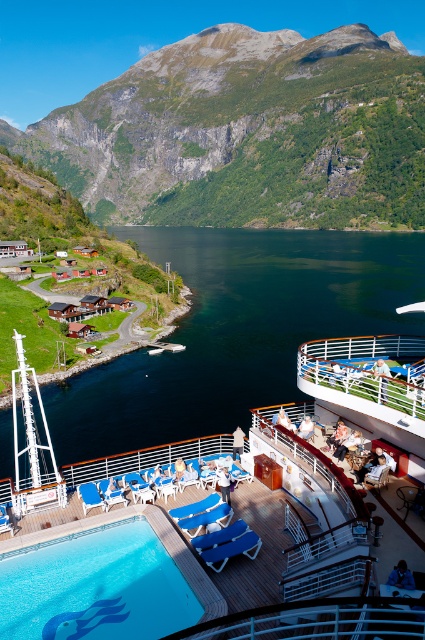
Question: Can you confirm if dark blue water at center is smaller than blue glossy pool at lower left?

Choices:
 (A) no
 (B) yes

Answer: (A)

Question: Estimate the real-world distances between objects in this image. Which object is closer to the green textured mountain at upper left?

Choices:
 (A) dark blue water at center
 (B) blue glossy pool at lower left

Answer: (A)

Question: Among these points, which one is nearest to the camera?

Choices:
 (A) (214, 221)
 (B) (82, 397)

Answer: (B)

Question: Is green textured mountain at upper left in front of blue glossy pool at lower left?

Choices:
 (A) yes
 (B) no

Answer: (B)

Question: Does green textured mountain at upper left have a lesser width compared to dark blue water at center?

Choices:
 (A) yes
 (B) no

Answer: (B)

Question: Which of the following is the farthest from the observer?

Choices:
 (A) (263, 394)
 (B) (158, 552)

Answer: (A)